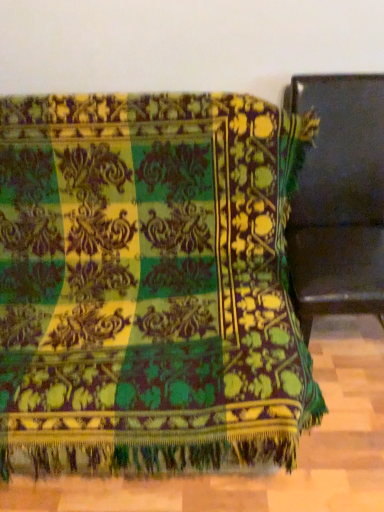
How much space does velvet green blanket at center, the second furniture positioned from the right, occupy vertically?

velvet green blanket at center, the second furniture positioned from the right, is 37.22 inches tall.

Find the location of `velvet green blanket at center, the first furniture when ordered from left to right`. velvet green blanket at center, the first furniture when ordered from left to right is located at coordinates (149, 285).

What do you see at coordinates (149, 285) in the screenshot?
I see `velvet green blanket at center, the first furniture when ordered from left to right` at bounding box center [149, 285].

The width and height of the screenshot is (384, 512). Find the location of `matte black chair at right, the 1th furniture positioned from the right`. matte black chair at right, the 1th furniture positioned from the right is located at coordinates (339, 200).

What do you see at coordinates (339, 200) in the screenshot?
I see `matte black chair at right, which is counted as the 2th furniture, starting from the left` at bounding box center [339, 200].

I want to click on velvet green blanket at center, the second furniture positioned from the right, so click(x=149, y=285).

Can you confirm if matte black chair at right, the 1th furniture positioned from the right, is positioned to the right of velvet green blanket at center, the second furniture positioned from the right?

Yes.

Considering the positions of objects matte black chair at right, the 1th furniture positioned from the right, and velvet green blanket at center, the second furniture positioned from the right, in the image provided, who is in front, matte black chair at right, the 1th furniture positioned from the right, or velvet green blanket at center, the second furniture positioned from the right,?

velvet green blanket at center, the second furniture positioned from the right, is more forward.

Does point (325, 190) lie behind point (179, 236)?

Yes, it is.

From the image's perspective, between matte black chair at right, which is counted as the 2th furniture, starting from the left, and velvet green blanket at center, the first furniture when ordered from left to right, who is located below?

velvet green blanket at center, the first furniture when ordered from left to right, is shown below in the image.

From a real-world perspective, is matte black chair at right, the 1th furniture positioned from the right, above or below velvet green blanket at center, the second furniture positioned from the right?

matte black chair at right, the 1th furniture positioned from the right, is above velvet green blanket at center, the second furniture positioned from the right.

Considering the sizes of objects matte black chair at right, the 1th furniture positioned from the right, and velvet green blanket at center, the first furniture when ordered from left to right, in the image provided, who is wider, matte black chair at right, the 1th furniture positioned from the right, or velvet green blanket at center, the first furniture when ordered from left to right,?

Wider between the two is velvet green blanket at center, the first furniture when ordered from left to right.

From their relative heights in the image, would you say matte black chair at right, the 1th furniture positioned from the right, is taller or shorter than velvet green blanket at center, the first furniture when ordered from left to right?

matte black chair at right, the 1th furniture positioned from the right, is taller than velvet green blanket at center, the first furniture when ordered from left to right.

Based on their sizes in the image, would you say matte black chair at right, the 1th furniture positioned from the right, is bigger or smaller than velvet green blanket at center, the first furniture when ordered from left to right?

matte black chair at right, the 1th furniture positioned from the right, is smaller than velvet green blanket at center, the first furniture when ordered from left to right.

Is matte black chair at right, the 1th furniture positioned from the right, outside of velvet green blanket at center, the second furniture positioned from the right?

Indeed, matte black chair at right, the 1th furniture positioned from the right, is completely outside velvet green blanket at center, the second furniture positioned from the right.

Is matte black chair at right, which is counted as the 2th furniture, starting from the left, next to velvet green blanket at center, the first furniture when ordered from left to right, and touching it?

No, matte black chair at right, which is counted as the 2th furniture, starting from the left, is not touching velvet green blanket at center, the first furniture when ordered from left to right.

Could you tell me if matte black chair at right, which is counted as the 2th furniture, starting from the left, is facing velvet green blanket at center, the second furniture positioned from the right?

No, matte black chair at right, which is counted as the 2th furniture, starting from the left, is not oriented towards velvet green blanket at center, the second furniture positioned from the right.

How different are the orientations of matte black chair at right, which is counted as the 2th furniture, starting from the left, and velvet green blanket at center, the first furniture when ordered from left to right, in degrees?

matte black chair at right, which is counted as the 2th furniture, starting from the left, and velvet green blanket at center, the first furniture when ordered from left to right, are facing 3.18 degrees away from each other.

Measure the distance from matte black chair at right, the 1th furniture positioned from the right, to velvet green blanket at center, the first furniture when ordered from left to right.

matte black chair at right, the 1th furniture positioned from the right, and velvet green blanket at center, the first furniture when ordered from left to right, are 15.71 inches apart.

Find the location of a particular element. The image size is (384, 512). furniture on the left of matte black chair at right, the 1th furniture positioned from the right is located at coordinates (149, 285).

Does velvet green blanket at center, the first furniture when ordered from left to right, appear on the right side of matte black chair at right, the 1th furniture positioned from the right?

In fact, velvet green blanket at center, the first furniture when ordered from left to right, is to the left of matte black chair at right, the 1th furniture positioned from the right.

Is velvet green blanket at center, the second furniture positioned from the right, further to the viewer compared to matte black chair at right, the 1th furniture positioned from the right?

No, it is in front of matte black chair at right, the 1th furniture positioned from the right.

Which is less distant, (93, 314) or (381, 118)?

The point (93, 314) is closer.

In the scene shown: From the image's perspective, is velvet green blanket at center, the second furniture positioned from the right, on top of matte black chair at right, the 1th furniture positioned from the right?

Actually, velvet green blanket at center, the second furniture positioned from the right, appears below matte black chair at right, the 1th furniture positioned from the right, in the image.

From a real-world perspective, relative to matte black chair at right, the 1th furniture positioned from the right, is velvet green blanket at center, the second furniture positioned from the right, vertically above or below?

From a real-world perspective, velvet green blanket at center, the second furniture positioned from the right, is physically below matte black chair at right, the 1th furniture positioned from the right.

Considering the relative sizes of velvet green blanket at center, the second furniture positioned from the right, and matte black chair at right, which is counted as the 2th furniture, starting from the left, in the image provided, is velvet green blanket at center, the second furniture positioned from the right, wider than matte black chair at right, which is counted as the 2th furniture, starting from the left,?

Yes, velvet green blanket at center, the second furniture positioned from the right, is wider than matte black chair at right, which is counted as the 2th furniture, starting from the left.

Which of these two, velvet green blanket at center, the second furniture positioned from the right, or matte black chair at right, which is counted as the 2th furniture, starting from the left, stands taller?

matte black chair at right, which is counted as the 2th furniture, starting from the left.

Can you confirm if velvet green blanket at center, the first furniture when ordered from left to right, is bigger than matte black chair at right, the 1th furniture positioned from the right?

Correct, velvet green blanket at center, the first furniture when ordered from left to right, is larger in size than matte black chair at right, the 1th furniture positioned from the right.

Would you say velvet green blanket at center, the first furniture when ordered from left to right, is outside matte black chair at right, the 1th furniture positioned from the right?

Yes, velvet green blanket at center, the first furniture when ordered from left to right, is located beyond the bounds of matte black chair at right, the 1th furniture positioned from the right.

Is velvet green blanket at center, the second furniture positioned from the right, beside matte black chair at right, which is counted as the 2th furniture, starting from the left?

velvet green blanket at center, the second furniture positioned from the right, and matte black chair at right, which is counted as the 2th furniture, starting from the left, are not in contact.

Is velvet green blanket at center, the second furniture positioned from the right, facing towards matte black chair at right, which is counted as the 2th furniture, starting from the left?

No, velvet green blanket at center, the second furniture positioned from the right, is not facing towards matte black chair at right, which is counted as the 2th furniture, starting from the left.

This screenshot has width=384, height=512. What are the coordinates of `furniture to the left of matte black chair at right, the 1th furniture positioned from the right` in the screenshot? It's located at (149, 285).

You are a GUI agent. You are given a task and a screenshot of the screen. Output one action in this format:
    pyautogui.click(x=<x>, y=<y>)
    Task: Click on the furniture that appears below the matte black chair at right, which is counted as the 2th furniture, starting from the left (from a real-world perspective)
    Image resolution: width=384 pixels, height=512 pixels.
    Given the screenshot: What is the action you would take?
    pyautogui.click(x=149, y=285)

Locate an element on the screen. The image size is (384, 512). furniture below the matte black chair at right, the 1th furniture positioned from the right (from the image's perspective) is located at coordinates (149, 285).